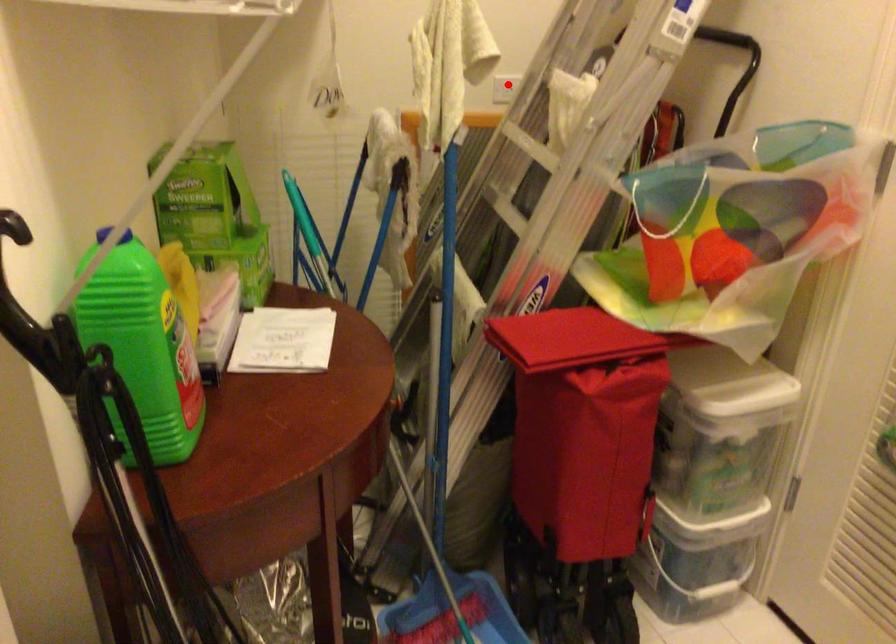
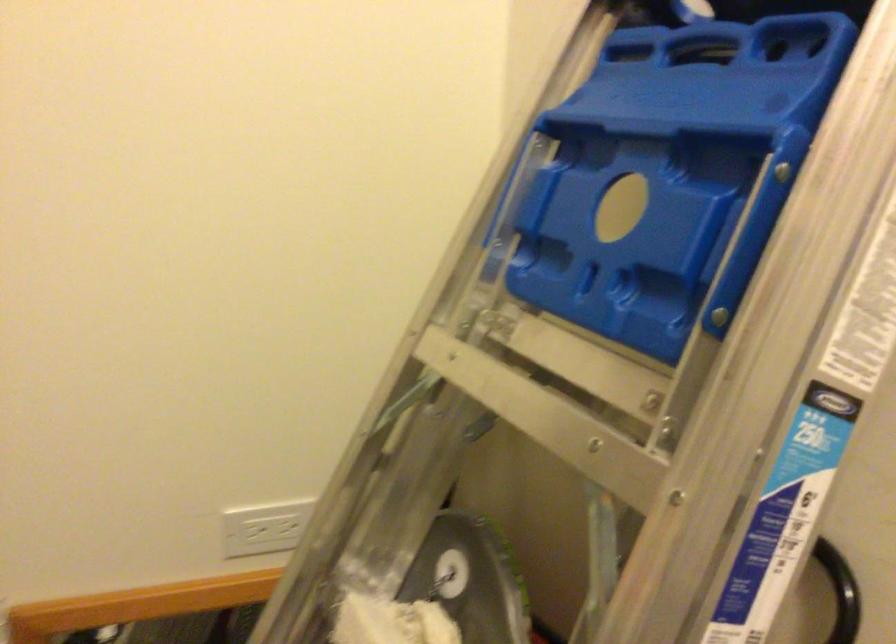
Question: I am providing you with two images of the same scene from different viewpoints. Image1 has a red point marked. In image2, the corresponding 3D location appears at what relative position? Reply with the corresponding letter.

Choices:
 (A) Closer
 (B) Farther

Answer: (A)